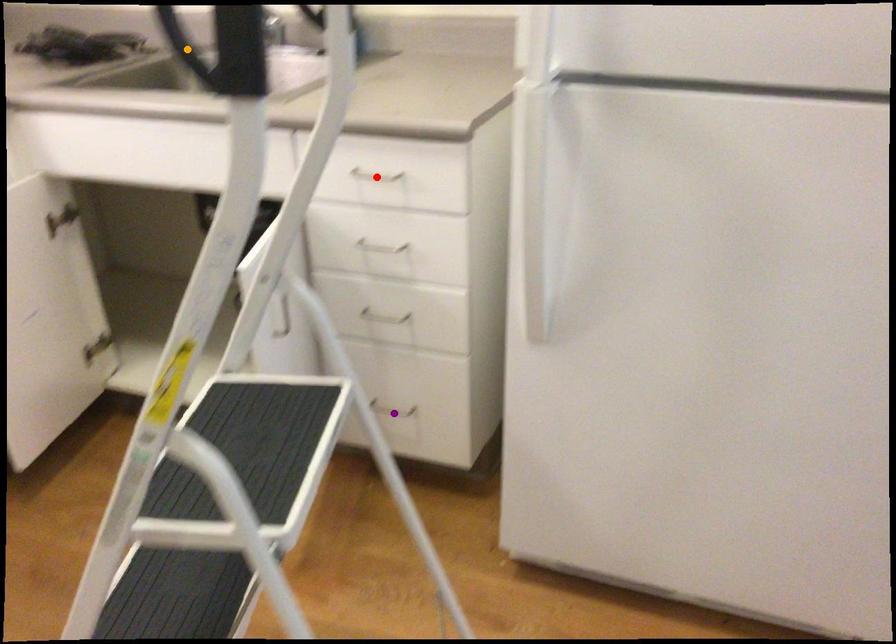
Order these from nearest to farthest:
orange point, red point, purple point

orange point, red point, purple point